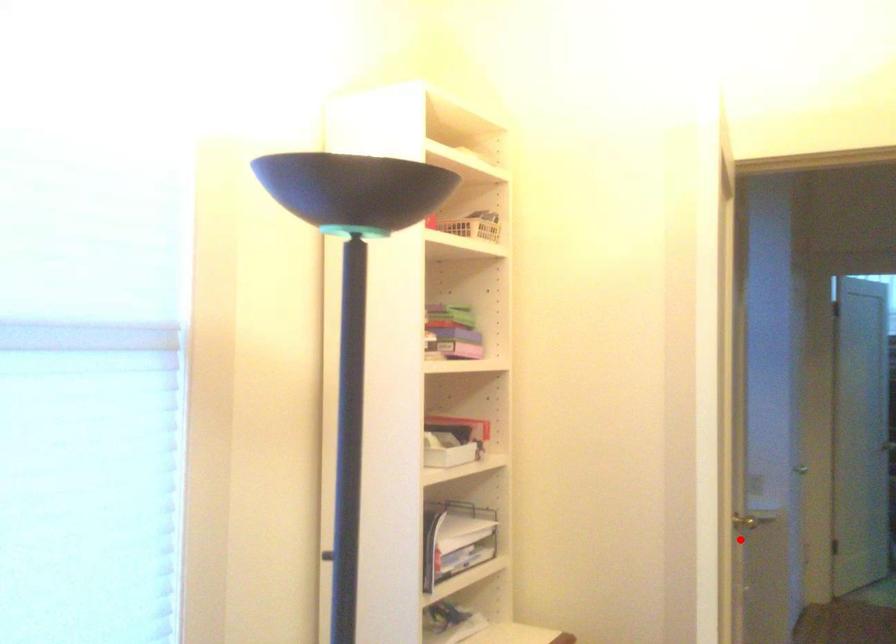
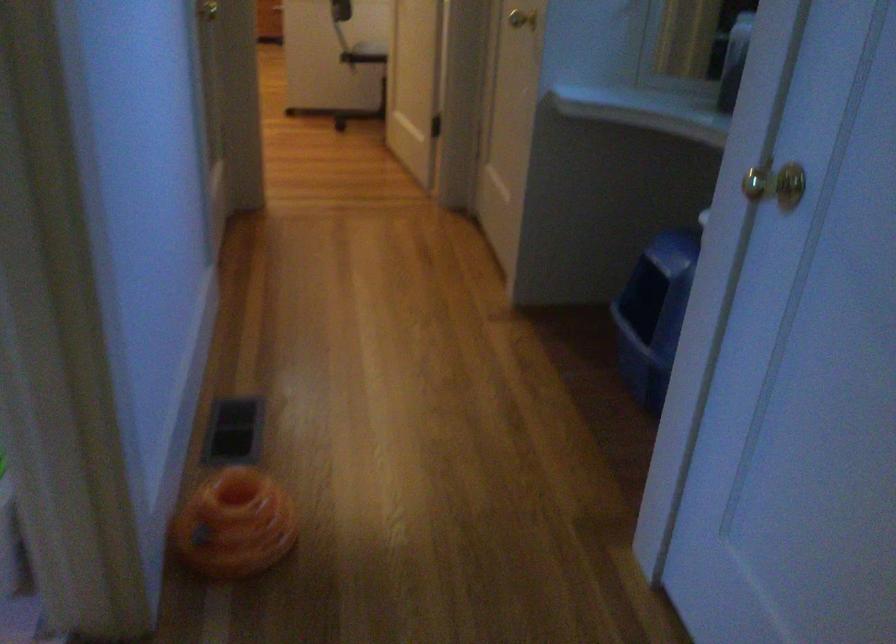
Question: I am providing you with two images of the same scene from different viewpoints. A red point is shown in image1. For the corresponding object point in image2, is it positioned nearer or farther from the camera?

Choices:
 (A) Nearer
 (B) Farther

Answer: (A)